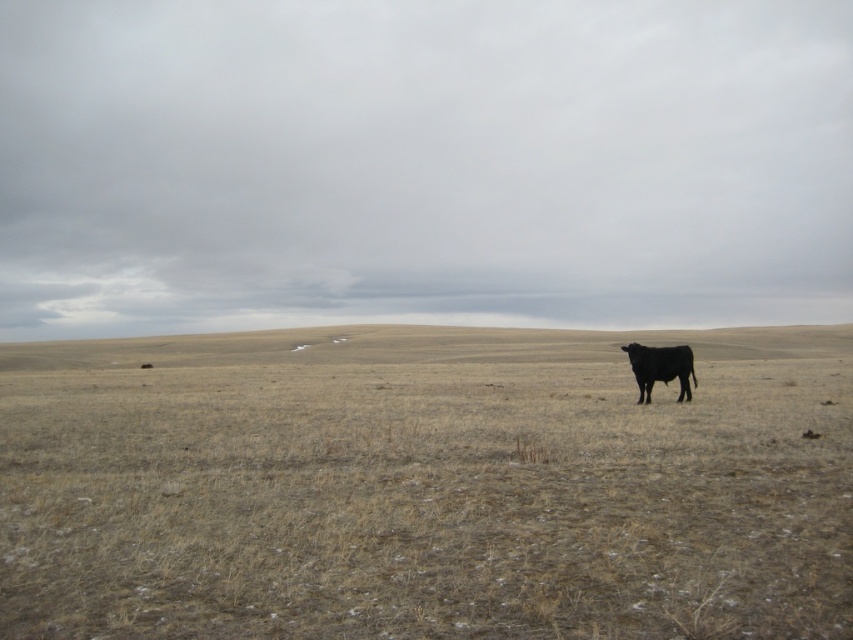
You are a photographer trying to capture a wide shot of the brown grassland at center and the black smooth bull at right. Based on the scene, which object occupies a larger area in the image?

The brown grassland at center might be wider than the black smooth bull at right.

You are a photographer trying to capture the black smooth bull at right in the background while focusing on the brown grassland at center. Based on their positions, can you position yourself so that the bull appears behind the grassland in the photo?

The brown grassland at center is located below the black smooth bull at right, so if you position yourself lower and aim upwards, the bull would appear above the grassland, making it look like it is behind the grassland in the photo.